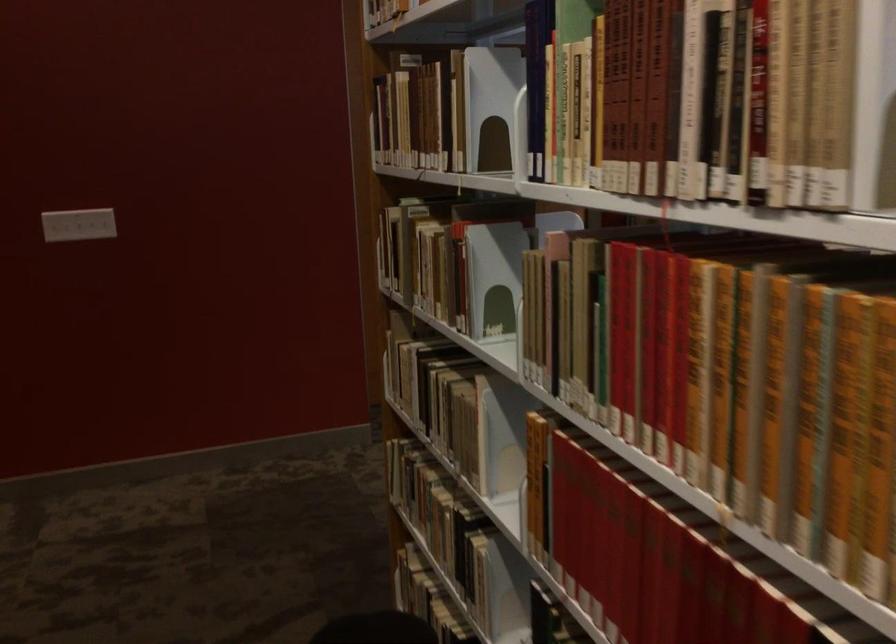
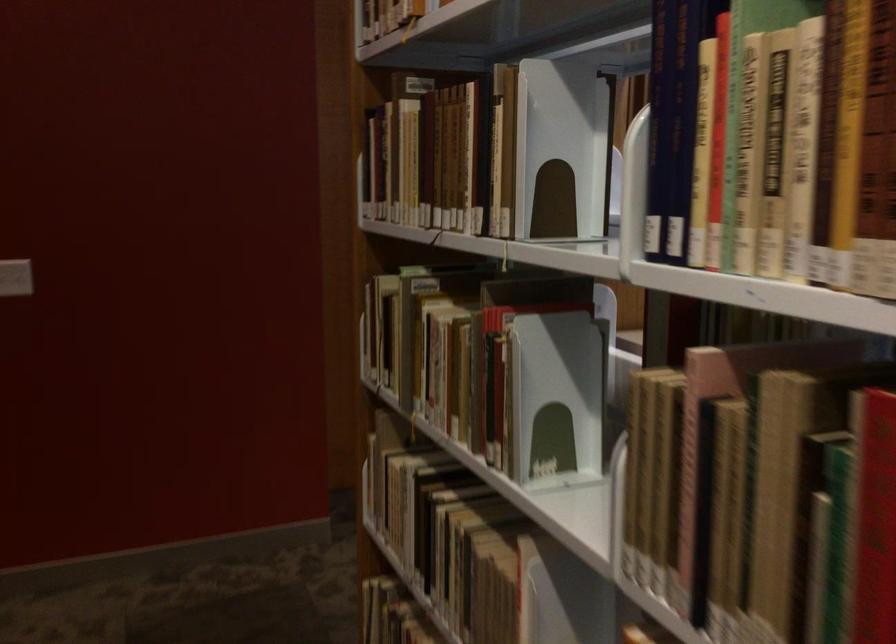
Question: The first image is from the beginning of the video and the second image is from the end. How did the camera likely rotate when shooting the video?

Choices:
 (A) Left
 (B) Right
 (C) Up
 (D) Down

Answer: (C)